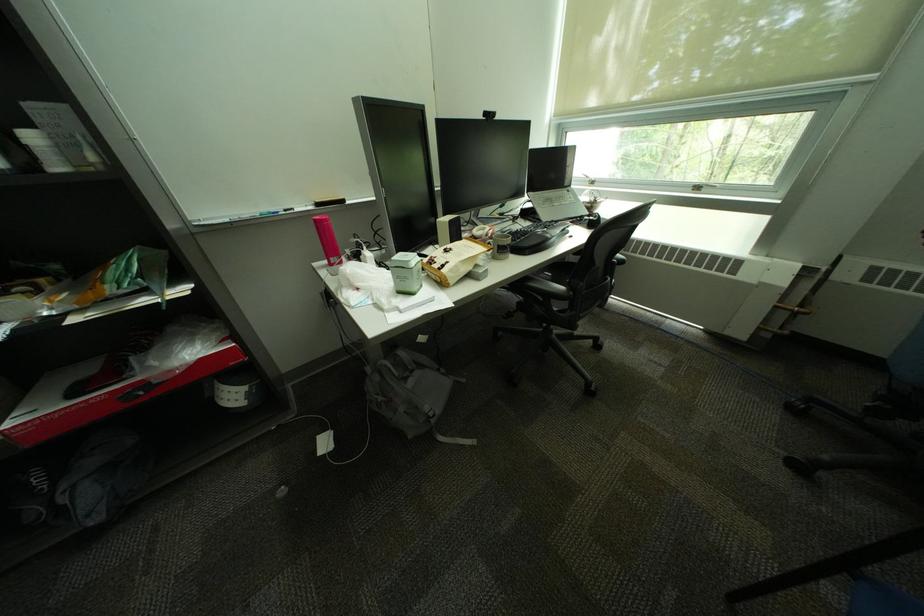
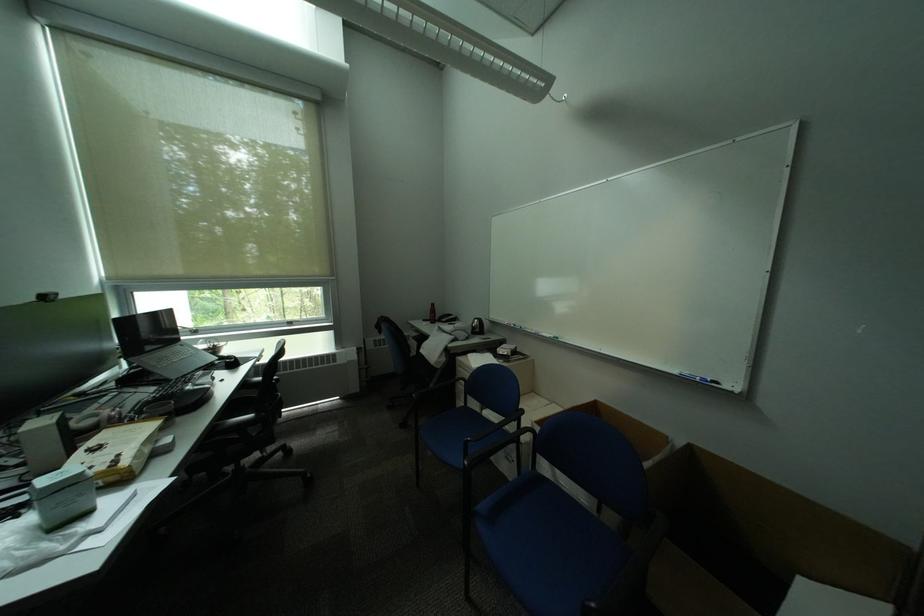
Question: The first image is from the beginning of the video and the second image is from the end. How did the camera likely rotate when shooting the video?

Choices:
 (A) Left
 (B) Right
 (C) Up
 (D) Down

Answer: (B)